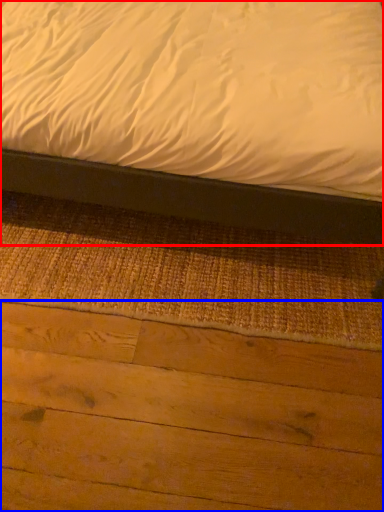
Question: Which of the following is the closest to the observer, bed (highlighted by a red box) or plywood (highlighted by a blue box)?

Choices:
 (A) bed
 (B) plywood

Answer: (A)